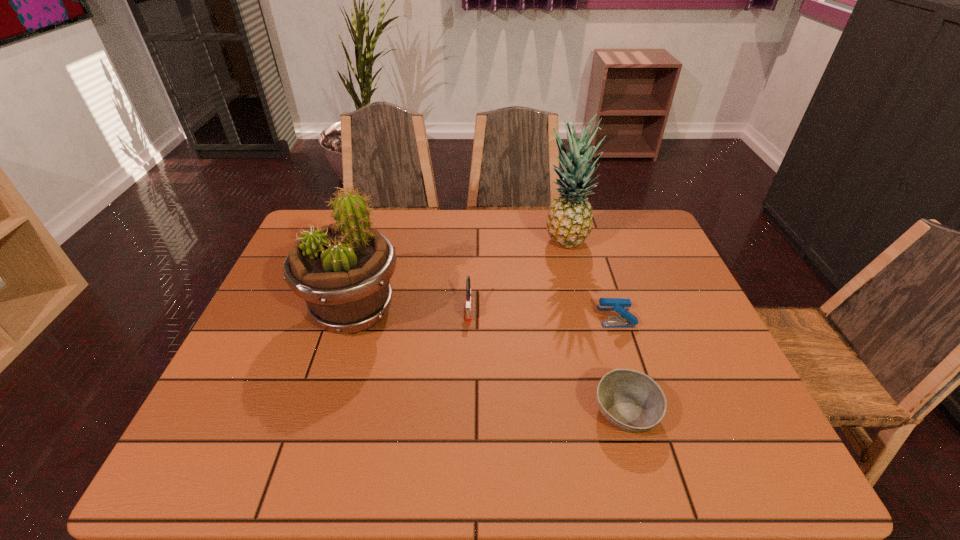
This screenshot has width=960, height=540. In order to click on free space between the bowl and the third shortest object in this screenshot , I will do `click(547, 360)`.

In order to click on free space between the second object from left to right and the pineapple in this screenshot , I will do `click(516, 275)`.

Locate an element on the screen. The width and height of the screenshot is (960, 540). the fourth closest object relative to the flowerpot is located at coordinates (627, 320).

Where is `the closest object relative to the farthest object`? the closest object relative to the farthest object is located at coordinates (627, 320).

Where is `blank space that satisfies the following two spatial constraints: 1. on the handle side of the fourth tallest object; 2. on the left side of the second object from left to right`? The height and width of the screenshot is (540, 960). blank space that satisfies the following two spatial constraints: 1. on the handle side of the fourth tallest object; 2. on the left side of the second object from left to right is located at coordinates (468, 316).

The image size is (960, 540). Identify the location of free space that satisfies the following two spatial constraints: 1. on the front side of the right stapler; 2. on the left side of the leftmost object. (352, 316).

The width and height of the screenshot is (960, 540). Find the location of `vacant space that satisfies the following two spatial constraints: 1. on the front side of the bowl; 2. on the left side of the flowerpot`. vacant space that satisfies the following two spatial constraints: 1. on the front side of the bowl; 2. on the left side of the flowerpot is located at coordinates (323, 412).

Identify the location of vacant region that satisfies the following two spatial constraints: 1. on the front side of the flowerpot; 2. on the right side of the bowl. The width and height of the screenshot is (960, 540). (323, 412).